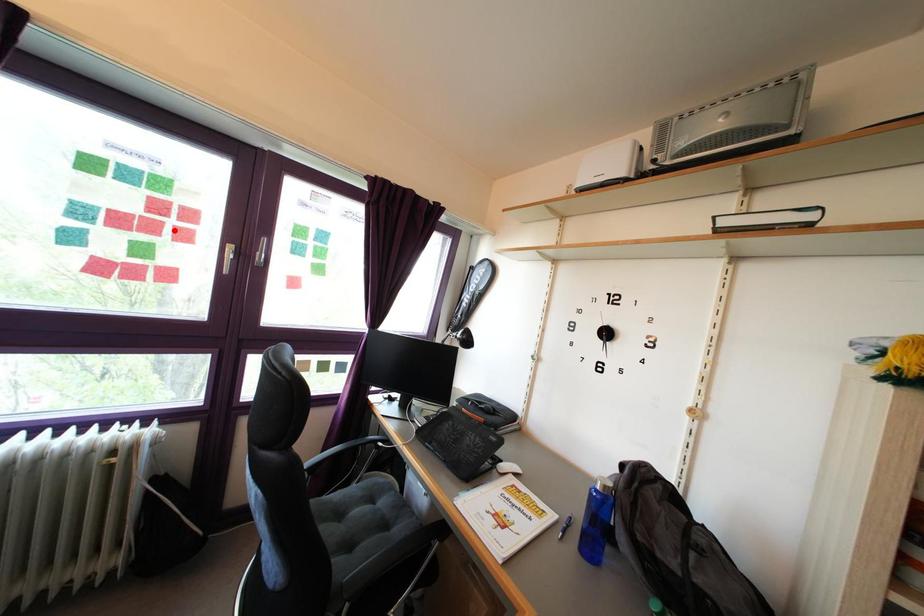
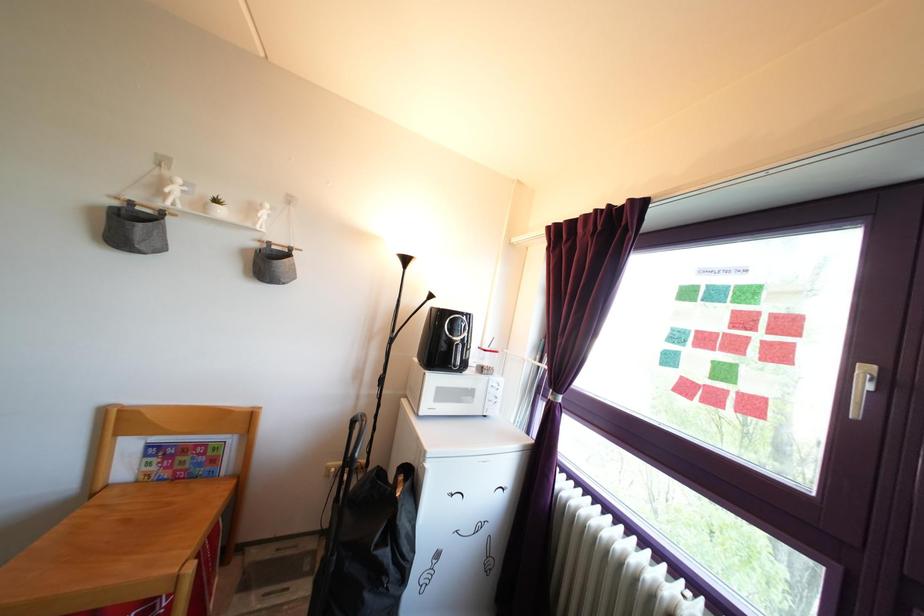
In the second image, find the point that corresponds to the highlighted location in the first image.

(761, 345)